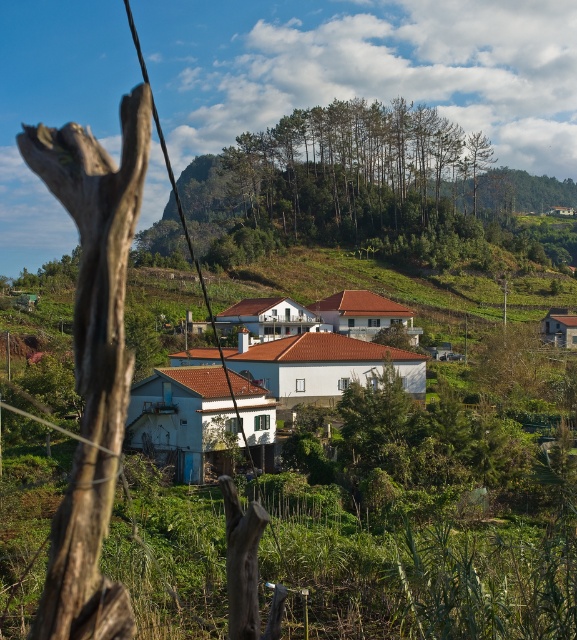
Question: Which point is closer to the camera taking this photo?

Choices:
 (A) (353, 292)
 (B) (316, 170)

Answer: (A)

Question: Is the position of white matte house at center more distant than that of black wire at left?

Choices:
 (A) yes
 (B) no

Answer: (A)

Question: Which is nearer to the green leafy trees at upper center?

Choices:
 (A) white matte house at center
 (B) black wire at left

Answer: (B)

Question: Considering the relative positions of green leafy trees at upper center and black wire at left in the image provided, where is green leafy trees at upper center located with respect to black wire at left?

Choices:
 (A) above
 (B) below

Answer: (B)

Question: Which object is closer to the camera taking this photo?

Choices:
 (A) black wire at left
 (B) white matte house at center
 (C) green leafy trees at upper center

Answer: (A)

Question: Does green leafy trees at upper center have a greater width compared to white matte house at center?

Choices:
 (A) no
 (B) yes

Answer: (B)